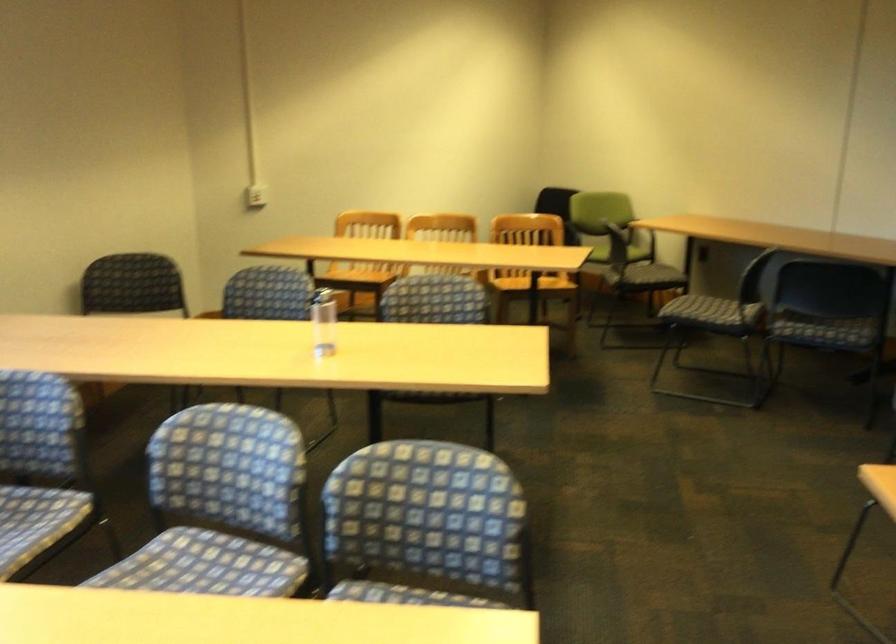
This screenshot has height=644, width=896. Describe the element at coordinates (221, 506) in the screenshot. I see `the green chair sitting surface` at that location.